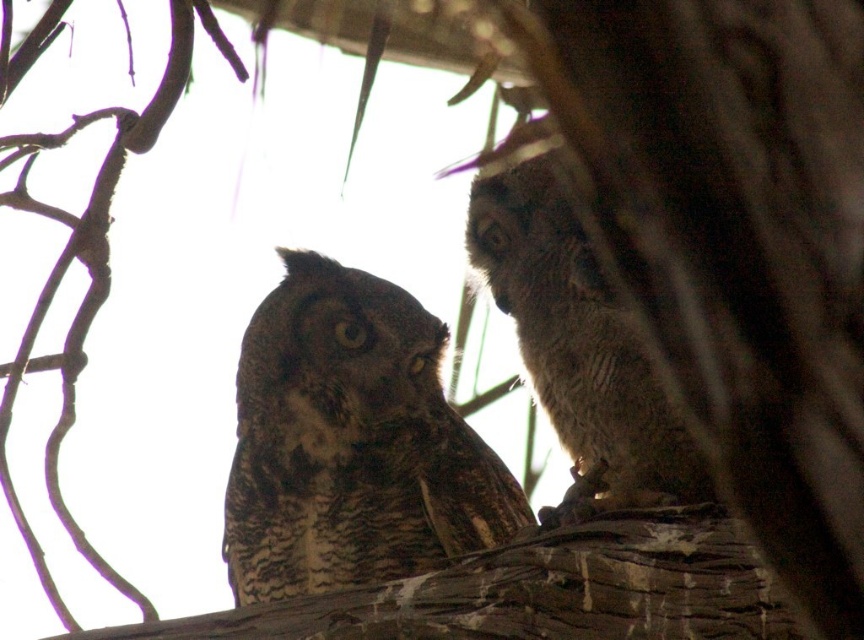
You are a birdwatcher trying to identify two owls in a tree. You see a brown speckled owl at center and a speckled brown owl at right. Which owl has a greater width?

The brown speckled owl at center has a greater width than the speckled brown owl at right.

You are a birdwatcher trying to identify two owls in the image. The scene shows a brown speckled owl at center and a speckled brown owl at right. Which owl is larger in size?

The speckled brown owl at right is larger in size compared to the brown speckled owl at center.